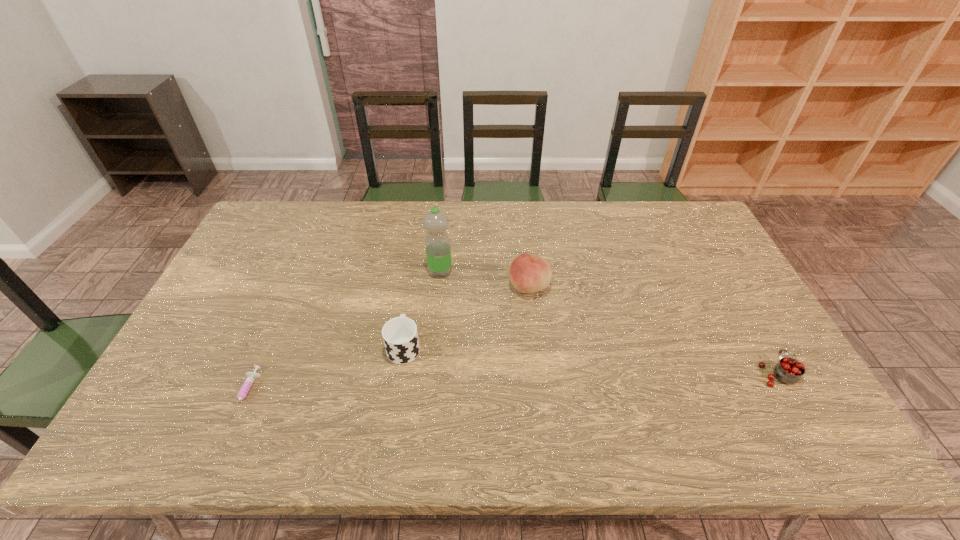
This screenshot has width=960, height=540. I want to click on vacant region at the right edge of the desktop, so click(702, 273).

You are a GUI agent. You are given a task and a screenshot of the screen. Output one action in this format:
    pyautogui.click(x=<x>, y=<y>)
    Task: Click on the free space at the far right corner of the desktop
    
    Given the screenshot: What is the action you would take?
    pyautogui.click(x=667, y=241)

Where is `free space between the fourth object from left to right and the cup`? free space between the fourth object from left to right and the cup is located at coordinates (467, 316).

At what (x,y) coordinates should I click in order to perform the action: click on free space between the shortest object and the tallest object. Please return your answer as a coordinate pair (x, y). Looking at the image, I should click on (344, 333).

Locate an element on the screen. The height and width of the screenshot is (540, 960). vacant area that lies between the leftmost object and the tallest object is located at coordinates (344, 333).

Locate an element on the screen. The width and height of the screenshot is (960, 540). unoccupied position between the rightmost object and the cup is located at coordinates (590, 360).

Where is `unoccupied area between the fourth object from left to right and the cherry`? The image size is (960, 540). unoccupied area between the fourth object from left to right and the cherry is located at coordinates (653, 330).

I want to click on vacant region between the peach and the rightmost object, so click(653, 330).

What are the coordinates of `unoccupied area between the cherry and the cup` in the screenshot? It's located at (590, 360).

What are the coordinates of `vacant space in between the tallest object and the rightmost object` in the screenshot? It's located at (609, 322).